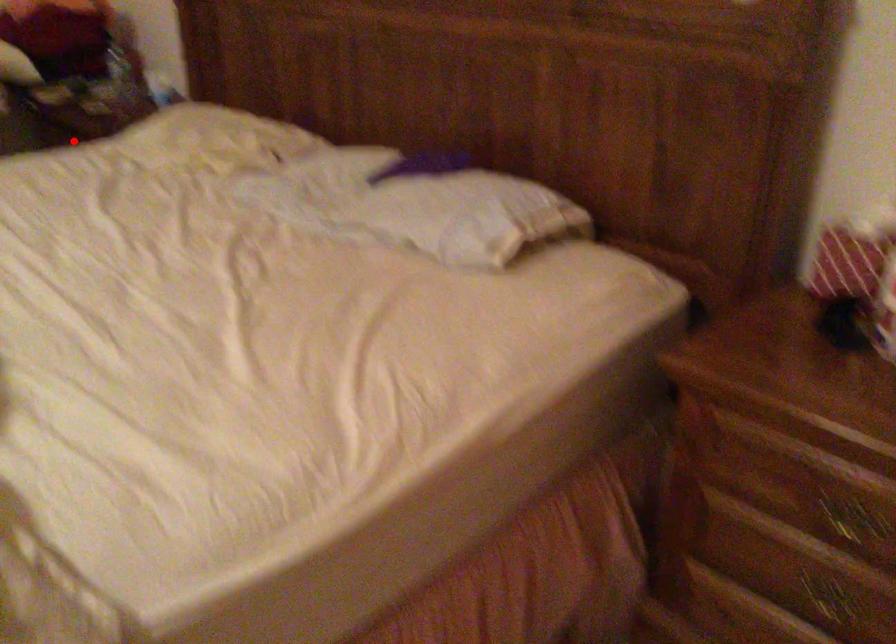
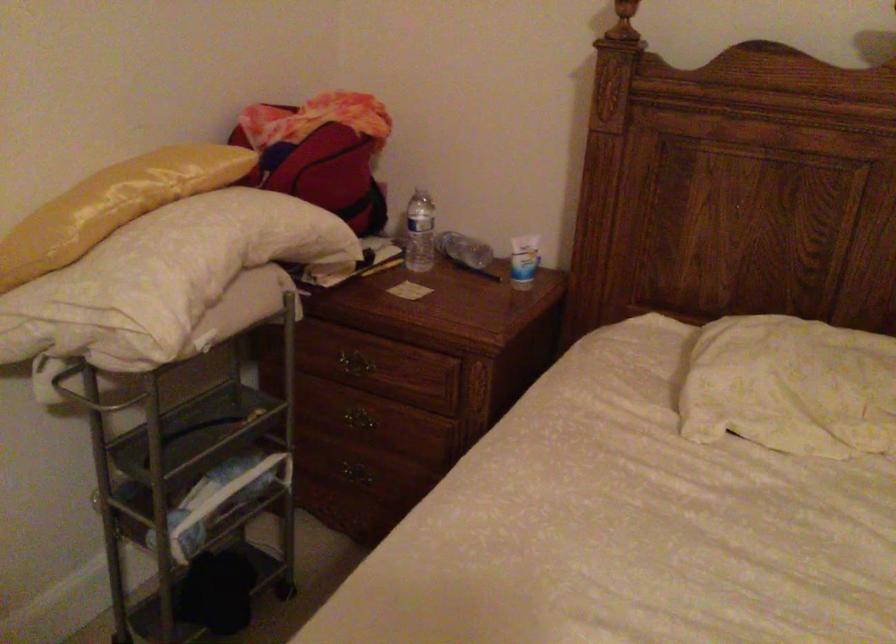
Find the pixel in the second image that matches the highlighted location in the first image.

(350, 365)